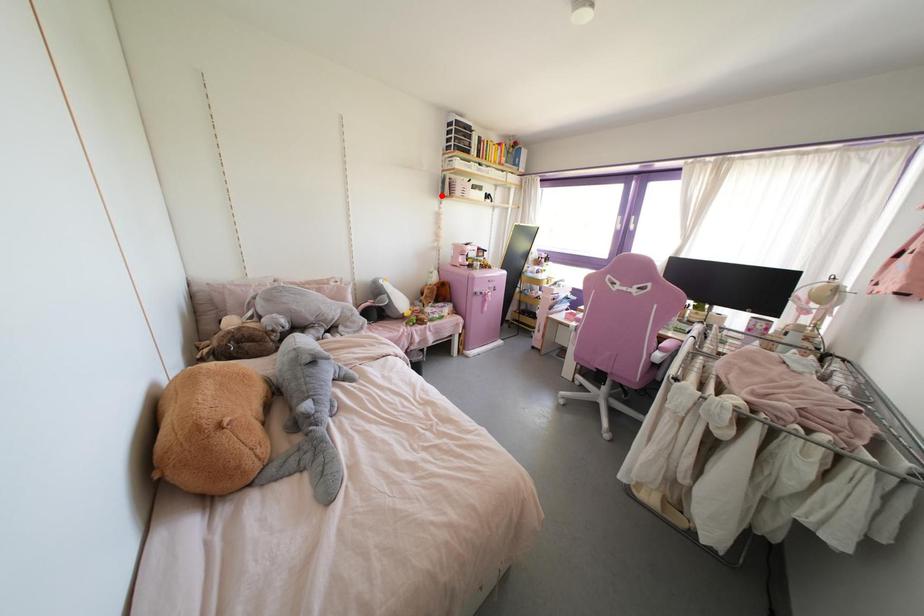
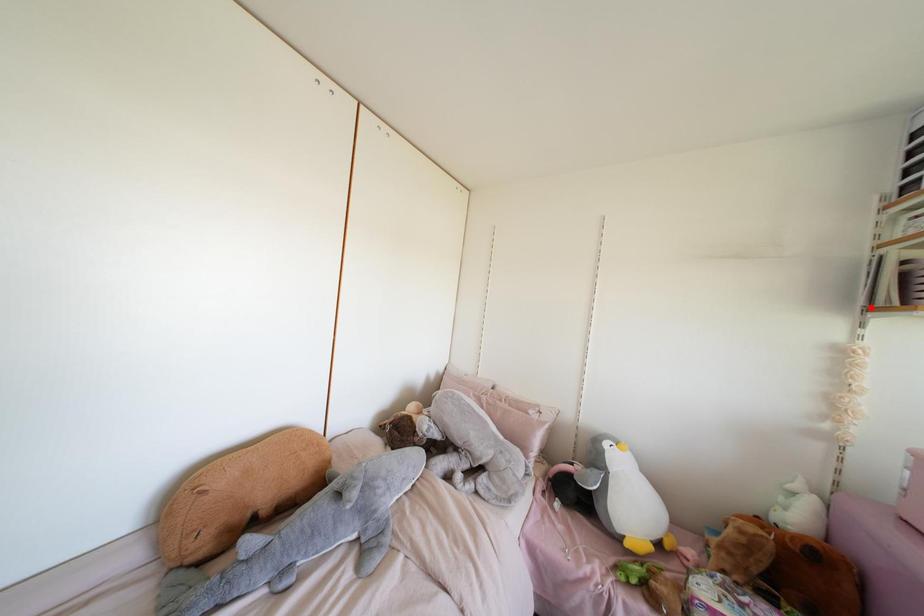
I am providing you with two images of the same scene from different viewpoints. A red point is marked on the first image and another point is marked on the second image. Does the point marked in image1 correspond to the same location as the one in image2?

Yes